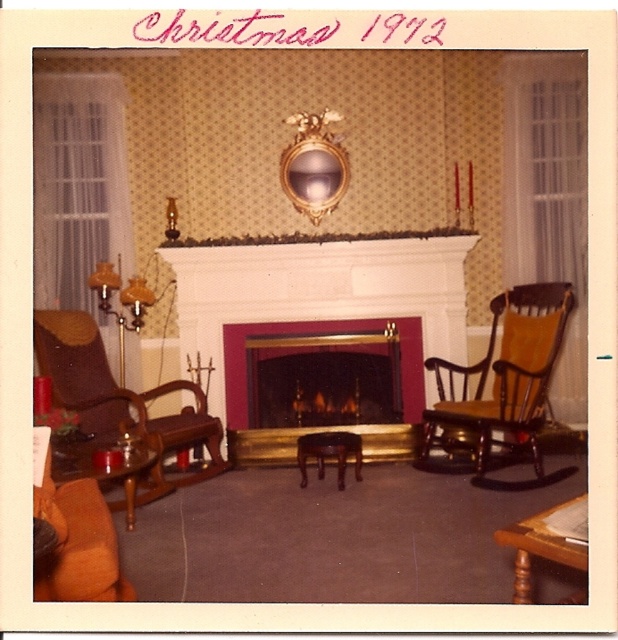
Question: Which of the following is the farthest from the observer?

Choices:
 (A) wooden rocking chair at right
 (B) wooden coffee table at lower left
 (C) wooden table at lower right
 (D) mahogany wood stool at center

Answer: (D)

Question: Is wooden coffee table at lower left closer to the viewer compared to mahogany wood stool at center?

Choices:
 (A) yes
 (B) no

Answer: (A)

Question: Which of the following is the closest to the observer?

Choices:
 (A) mahogany wood stool at center
 (B) wooden coffee table at lower left
 (C) gold metallic fireplace at center

Answer: (B)

Question: Based on their relative distances, which object is nearer to the gold metallic fireplace at center?

Choices:
 (A) wooden table at lower right
 (B) wooden rocking chair at right

Answer: (B)

Question: Can you confirm if wooden rocking chair at right is positioned to the right of mahogany wood stool at center?

Choices:
 (A) yes
 (B) no

Answer: (A)

Question: Is wooden table at lower right below mahogany wood stool at center?

Choices:
 (A) no
 (B) yes

Answer: (A)